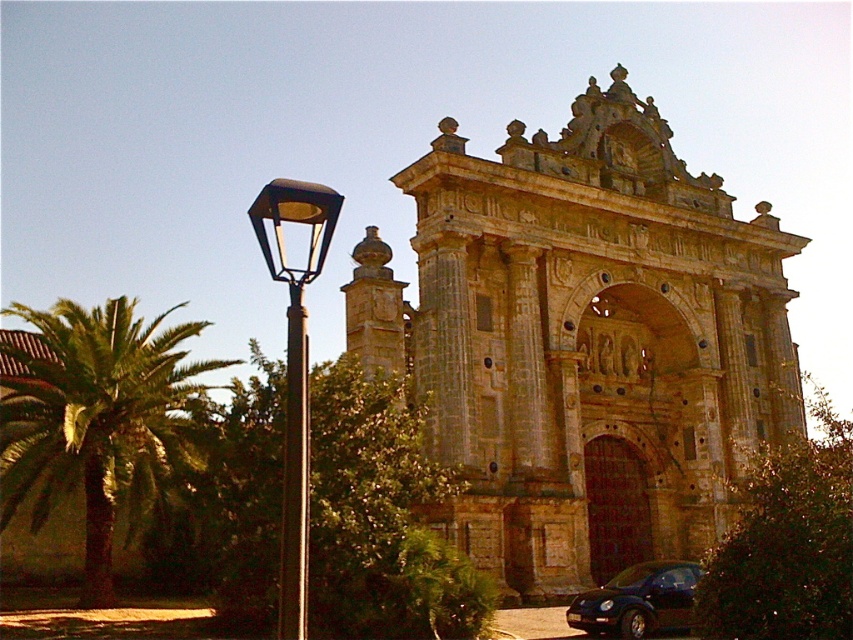
Question: Which object is positioned farthest from the brown polished pole at left?

Choices:
 (A) green leafy palm at left
 (B) stone carved church at center
 (C) shiny black car at lower right

Answer: (B)

Question: Can you confirm if green leafy palm at left is positioned above black metal street light at left?

Choices:
 (A) yes
 (B) no

Answer: (B)

Question: Which point is farther to the camera?

Choices:
 (A) pos(308,236)
 (B) pos(293,369)

Answer: (A)

Question: Which object is the farthest from the black metal street light at left?

Choices:
 (A) stone carved church at center
 (B) shiny black car at lower right
 (C) green leafy palm at left

Answer: (A)

Question: Is stone carved church at center closer to camera compared to shiny black car at lower right?

Choices:
 (A) no
 (B) yes

Answer: (A)

Question: Considering the relative positions of black metal street light at left and shiny black car at lower right in the image provided, where is black metal street light at left located with respect to shiny black car at lower right?

Choices:
 (A) above
 (B) below

Answer: (A)